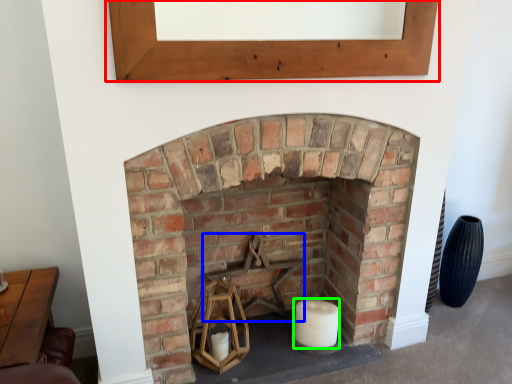
Question: Based on their relative distances, which object is farther from window frame (highlighted by a red box)? Choose from armchair (highlighted by a blue box) and candle (highlighted by a green box).

Choices:
 (A) armchair
 (B) candle

Answer: (B)